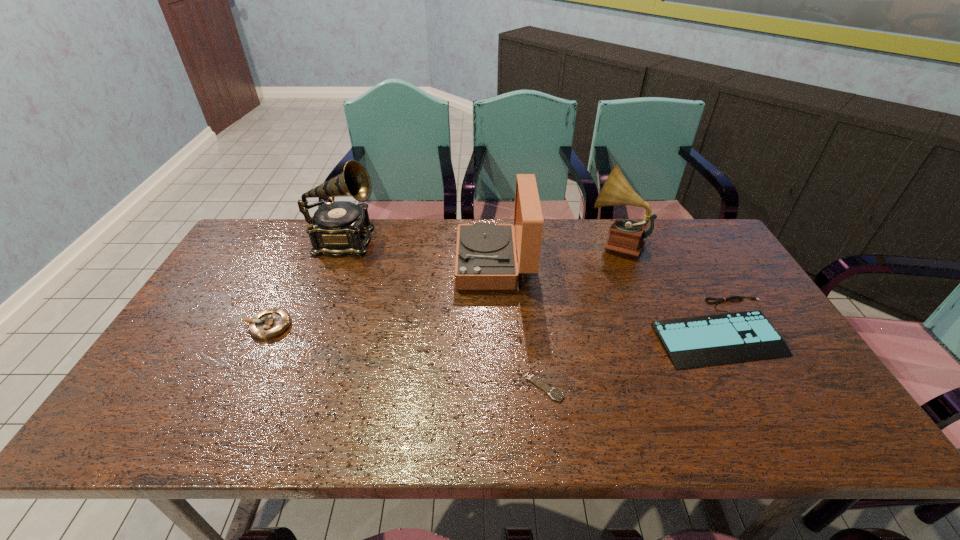
I want to click on vacant space at the left edge, so click(201, 314).

In the image, there is a desktop. In order to click on vacant space at the near left corner in this screenshot , I will do `click(133, 442)`.

This screenshot has height=540, width=960. What are the coordinates of `vacant space at the far right corner of the desktop` in the screenshot? It's located at (679, 220).

The height and width of the screenshot is (540, 960). I want to click on vacant area that lies between the ashtray and the shortest object, so click(406, 356).

You are a GUI agent. You are given a task and a screenshot of the screen. Output one action in this format:
    pyautogui.click(x=<x>, y=<y>)
    Task: Click on the vacant region between the nearest object and the ashtray
    
    Given the screenshot: What is the action you would take?
    pyautogui.click(x=406, y=356)

Find the location of a particular element. This screenshot has height=540, width=960. free spot between the ashtray and the computer keyboard is located at coordinates (492, 328).

This screenshot has width=960, height=540. What are the coordinates of `vacant area between the computer keyboard and the third shortest object` in the screenshot? It's located at (492, 328).

This screenshot has width=960, height=540. What are the coordinates of `free space between the watch and the rightmost phonograph record` in the screenshot? It's located at (579, 315).

Find the location of `free space between the ashtray and the shortest object`. free space between the ashtray and the shortest object is located at coordinates pyautogui.click(x=406, y=356).

At what (x,y) coordinates should I click in order to perform the action: click on unoccupied position between the nearest object and the second phonograph record from left to right. Please return your answer as a coordinate pair (x, y). Looking at the image, I should click on (519, 326).